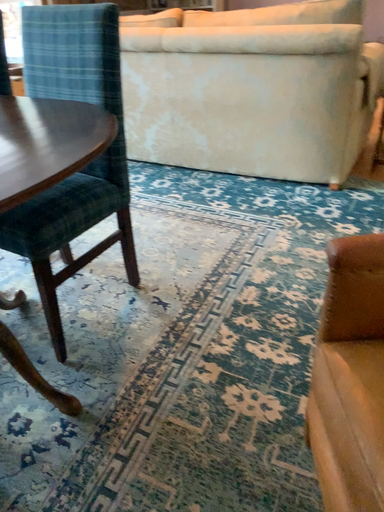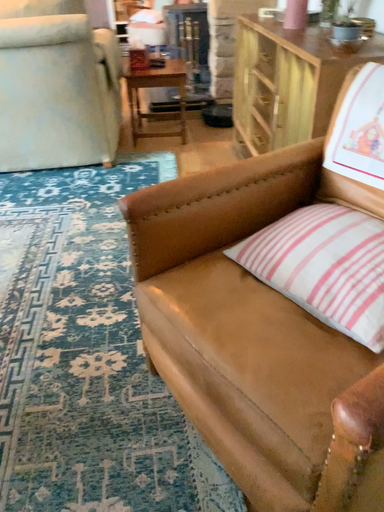
Question: Which way did the camera rotate in the video?

Choices:
 (A) rotated right
 (B) rotated left

Answer: (A)